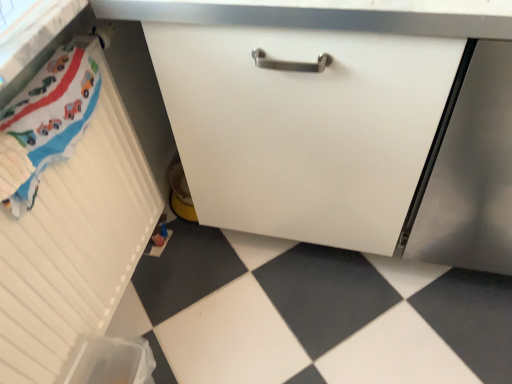
Identify the location of free space between white matte cabinet at center, which appears as the 2th cabinetry when viewed from the left, and satin silver screen door at lower right. (304, 266).